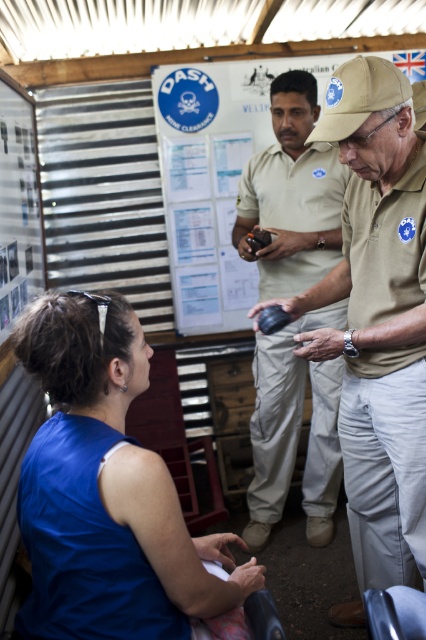
Question: Which point is farther to the camera?

Choices:
 (A) beige uniform at center
 (B) tan uniform at center
 (C) tan fabric baseball cap at center

Answer: (A)

Question: Which of the following is the farthest from the observer?

Choices:
 (A) (307, 84)
 (B) (374, 99)

Answer: (A)

Question: Does blue sleeveless top at lower left lie in front of beige uniform at center?

Choices:
 (A) yes
 (B) no

Answer: (A)

Question: Is blue sleeveless top at lower left positioned before tan fabric baseball cap at center?

Choices:
 (A) yes
 (B) no

Answer: (A)

Question: Does blue sleeveless top at lower left have a lesser width compared to beige uniform at center?

Choices:
 (A) no
 (B) yes

Answer: (A)

Question: Which is farther from the tan uniform at center?

Choices:
 (A) tan fabric baseball cap at center
 (B) beige uniform at center
 (C) blue sleeveless top at lower left

Answer: (B)